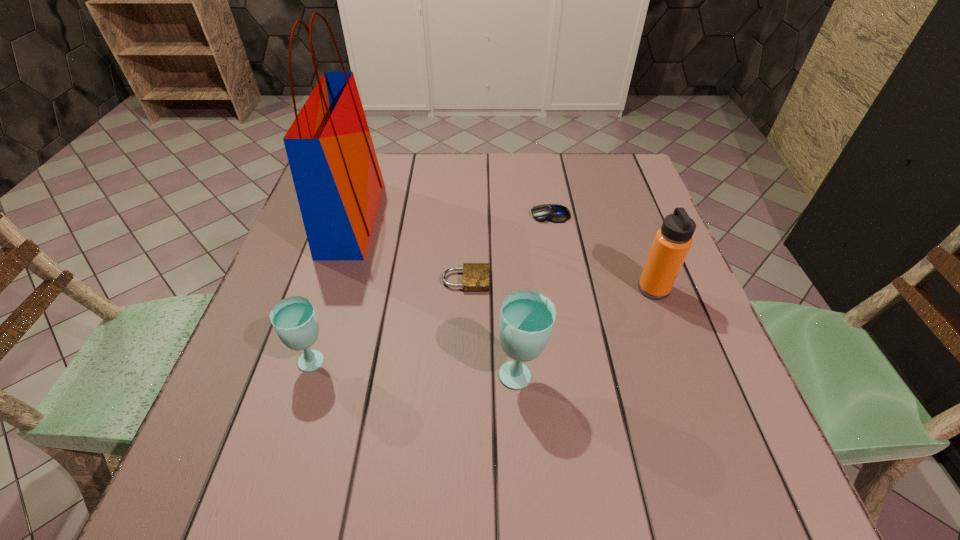
The image size is (960, 540). In order to click on blank space located on the right of the third shortest object in this screenshot , I will do `click(371, 362)`.

What are the coordinates of `free space located 0.260m on the left of the taller glass` in the screenshot? It's located at (356, 374).

You are a GUI agent. You are given a task and a screenshot of the screen. Output one action in this format:
    pyautogui.click(x=<x>, y=<y>)
    Task: Click on the free space located 0.190m on the handle side of the tallest object
    This screenshot has height=540, width=960.
    Given the screenshot: What is the action you would take?
    (451, 219)

The height and width of the screenshot is (540, 960). In order to click on free spot located 0.110m on the button side of the second shortest object in this screenshot , I will do `click(489, 215)`.

The height and width of the screenshot is (540, 960). Identify the location of free space located on the button side of the second shortest object. (500, 215).

Where is `free space located on the button side of the second shortest object`? This screenshot has width=960, height=540. free space located on the button side of the second shortest object is located at coordinates (462, 215).

Where is `vacant area located 0.190m on the keyhole side of the padlock`? The height and width of the screenshot is (540, 960). vacant area located 0.190m on the keyhole side of the padlock is located at coordinates (574, 280).

The image size is (960, 540). What are the coordinates of `free location located on the left of the rightmost object` in the screenshot? It's located at (597, 289).

You are a GUI agent. You are given a task and a screenshot of the screen. Output one action in this format:
    pyautogui.click(x=<x>, y=<y>)
    Task: Click on the object located at the far edge
    The image size is (960, 540).
    Given the screenshot: What is the action you would take?
    pyautogui.click(x=336, y=174)

This screenshot has width=960, height=540. I want to click on object that is at the near edge, so click(x=527, y=317).